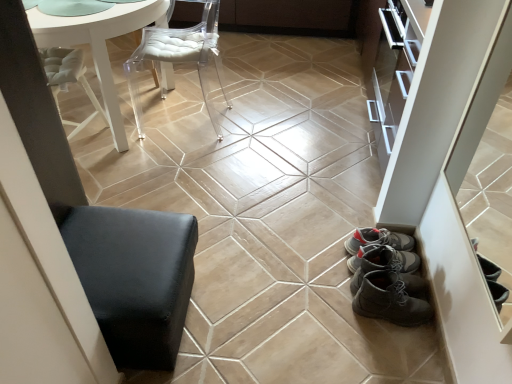
Where is `matte brown cabinet at upper center`? Image resolution: width=512 pixels, height=384 pixels. matte brown cabinet at upper center is located at coordinates (290, 17).

Measure the distance between point (108, 77) and camera.

The distance of point (108, 77) from camera is 2.13 meters.

Where is `black leather ottoman at lower left`? The height and width of the screenshot is (384, 512). black leather ottoman at lower left is located at coordinates (134, 278).

Find the location of a particular element. matte brown cabinet at upper center is located at coordinates (290, 17).

From a real-world perspective, who is located lower, white glossy table at upper left or transparent acrylic chair at upper center?

white glossy table at upper left, from a real-world perspective.

From the image's perspective, does white glossy table at upper left appear lower than transparent acrylic chair at upper center?

Actually, white glossy table at upper left appears above transparent acrylic chair at upper center in the image.

Which object is thinner, white glossy table at upper left or transparent acrylic chair at upper center?

With smaller width is transparent acrylic chair at upper center.

Does point (103, 77) lie in front of point (202, 83)?

Yes, point (103, 77) is in front of point (202, 83).

Where is `table behind the black leather ottoman at lower left`? This screenshot has height=384, width=512. table behind the black leather ottoman at lower left is located at coordinates (99, 44).

From a real-world perspective, is white glossy table at upper left located beneath black leather ottoman at lower left?

No.

Can you tell me how much white glossy table at upper left and black leather ottoman at lower left differ in facing direction?

There is a 90-degree angle between the facing directions of white glossy table at upper left and black leather ottoman at lower left.

From a real-world perspective, between white glossy table at upper left and beige glossy ceramic tile at center, who is vertically higher?

white glossy table at upper left, from a real-world perspective.

Locate an element on the screen. The height and width of the screenshot is (384, 512). ceramic tile in front of the white glossy table at upper left is located at coordinates (272, 251).

Which of these two, white glossy table at upper left or beige glossy ceramic tile at center, is bigger?

white glossy table at upper left is bigger.

Based on the photo, does white glossy table at upper left contain beige glossy ceramic tile at center?

That's incorrect, beige glossy ceramic tile at center is not inside white glossy table at upper left.

Considering the relative sizes of beige glossy ceramic tile at center and black leather ottoman at lower left in the image provided, is beige glossy ceramic tile at center thinner than black leather ottoman at lower left?

Correct, the width of beige glossy ceramic tile at center is less than that of black leather ottoman at lower left.

From the image's perspective, would you say beige glossy ceramic tile at center is positioned over black leather ottoman at lower left?

Yes, from the image's perspective, beige glossy ceramic tile at center is on top of black leather ottoman at lower left.

Is point (277, 240) more distant than point (130, 266)?

Yes, point (277, 240) is farther from viewer.

Between transparent acrylic chair at upper center and beige glossy ceramic tile at center, which one has larger width?

Wider between the two is transparent acrylic chair at upper center.

Between transparent acrylic chair at upper center and beige glossy ceramic tile at center, which one appears on the left side from the viewer's perspective?

transparent acrylic chair at upper center is more to the left.

Is point (197, 29) closer or farther from the camera than point (297, 274)?

Clearly, point (197, 29) is more distant from the camera than point (297, 274).

From their relative heights in the image, would you say transparent acrylic chair at upper center is taller or shorter than beige glossy ceramic tile at center?

Considering their sizes, transparent acrylic chair at upper center has more height than beige glossy ceramic tile at center.

Measure the distance from black leather ottoman at lower left to white glossy table at upper left.

The distance of black leather ottoman at lower left from white glossy table at upper left is 1.13 meters.

Is black leather ottoman at lower left smaller than white glossy table at upper left?

Indeed, black leather ottoman at lower left has a smaller size compared to white glossy table at upper left.

Is black leather ottoman at lower left positioned with its back to white glossy table at upper left?

No, white glossy table at upper left is not at the back of black leather ottoman at lower left.

Does point (168, 318) lie in front of point (111, 12)?

Yes, it is in front of point (111, 12).

Is black leather ottoman at lower left aimed at beige glossy ceramic tile at center?

No, black leather ottoman at lower left is not facing towards beige glossy ceramic tile at center.

Is black leather ottoman at lower left completely or partially outside of beige glossy ceramic tile at center?

Yes, black leather ottoman at lower left is located beyond the bounds of beige glossy ceramic tile at center.

Is black leather ottoman at lower left to the right of beige glossy ceramic tile at center from the viewer's perspective?

Incorrect, black leather ottoman at lower left is not on the right side of beige glossy ceramic tile at center.

What are the coordinates of `table below the transparent acrylic chair at upper center (from a real-world perspective)` in the screenshot? It's located at (99, 44).

The width and height of the screenshot is (512, 384). Find the location of `furniture that appears in front of the white glossy table at upper left`. furniture that appears in front of the white glossy table at upper left is located at coordinates (134, 278).

Which object lies nearer to the anchor point matte brown cabinet at upper center, beige glossy ceramic tile at center or white glossy table at upper left?

Among the two, white glossy table at upper left is located nearer to matte brown cabinet at upper center.

Considering their positions, is transparent acrylic chair at upper center positioned closer to black leather ottoman at lower left than beige glossy ceramic tile at center?

beige glossy ceramic tile at center lies closer to black leather ottoman at lower left than the other object.

Considering their positions, is beige glossy ceramic tile at center positioned further to white glossy table at upper left than black leather ottoman at lower left?

The object further to white glossy table at upper left is beige glossy ceramic tile at center.

Which object lies nearer to the anchor point beige glossy ceramic tile at center, matte brown cabinet at upper center or black leather ottoman at lower left?

black leather ottoman at lower left is closer to beige glossy ceramic tile at center.

From the image, which object appears to be nearer to black leather ottoman at lower left, transparent acrylic chair at upper center or white glossy table at upper left?

Among the two, white glossy table at upper left is located nearer to black leather ottoman at lower left.

Which object lies nearer to the anchor point matte brown cabinet at upper center, white glossy table at upper left or black leather ottoman at lower left?

white glossy table at upper left is positioned closer to the anchor matte brown cabinet at upper center.

Considering their positions, is white glossy table at upper left positioned closer to beige glossy ceramic tile at center than matte brown cabinet at upper center?

white glossy table at upper left is positioned closer to the anchor beige glossy ceramic tile at center.

Considering their positions, is white glossy table at upper left positioned further to transparent acrylic chair at upper center than black leather ottoman at lower left?

The object further to transparent acrylic chair at upper center is black leather ottoman at lower left.

Locate an element on the screen. Image resolution: width=512 pixels, height=384 pixels. ceramic tile between transparent acrylic chair at upper center and black leather ottoman at lower left in the vertical direction is located at coordinates (272, 251).

The image size is (512, 384). What are the coordinates of `chair positioned between black leather ottoman at lower left and matte brown cabinet at upper center from near to far` in the screenshot? It's located at (x=178, y=56).

Identify the location of chair between white glossy table at upper left and black leather ottoman at lower left in the up-down direction. This screenshot has width=512, height=384. (178, 56).

Locate an element on the screen. The image size is (512, 384). chair between white glossy table at upper left and beige glossy ceramic tile at center in the vertical direction is located at coordinates (178, 56).